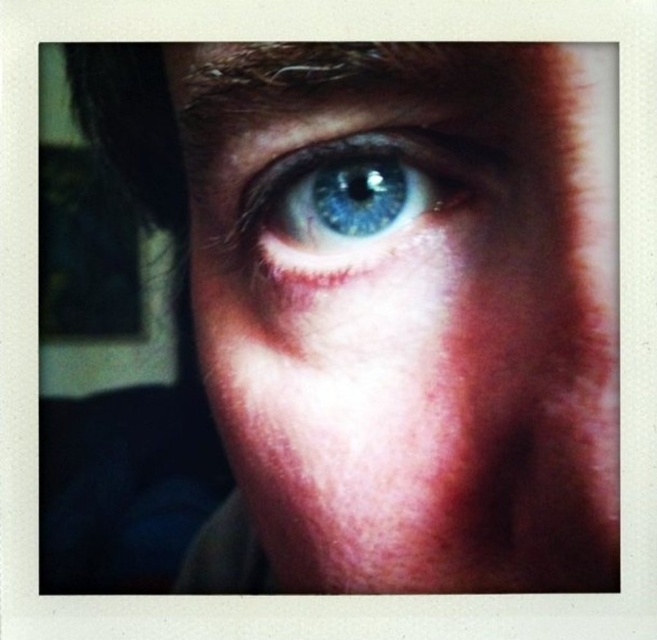
Question: Is blue matte eye at center bigger than blue glossy eye at upper center?

Choices:
 (A) yes
 (B) no

Answer: (A)

Question: Is blue matte eye at center smaller than blue glossy eye at upper center?

Choices:
 (A) no
 (B) yes

Answer: (A)

Question: Which object is farther from the camera taking this photo?

Choices:
 (A) blue matte eye at center
 (B) blue glossy eye at upper center

Answer: (B)

Question: Is blue matte eye at center further to camera compared to blue glossy eye at upper center?

Choices:
 (A) no
 (B) yes

Answer: (A)

Question: Which object appears farthest from the camera in this image?

Choices:
 (A) blue matte eye at center
 (B) blue glossy eye at upper center

Answer: (B)